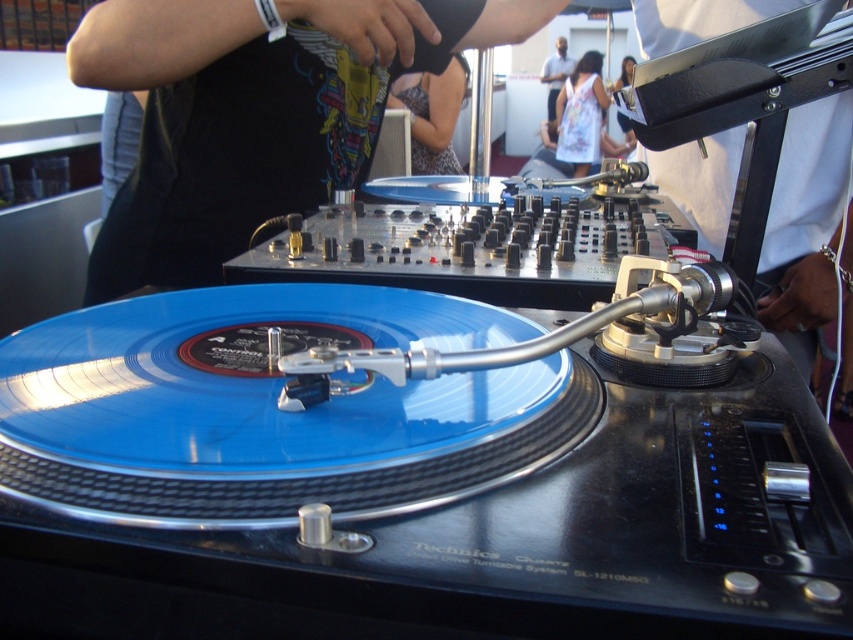
Is patterned fabric dress at center positioned behind dark blue shirt at upper center?

No, it is in front of dark blue shirt at upper center.

Who is higher up, patterned fabric dress at center or dark blue shirt at upper center?

dark blue shirt at upper center

Is point (421, 115) positioned in front of point (553, 72)?

Yes, point (421, 115) is in front of point (553, 72).

Where is `patterned fabric dress at center`? The width and height of the screenshot is (853, 640). patterned fabric dress at center is located at coordinates (433, 116).

Does black matte shirt at upper center have a greater height compared to dark blue shirt at upper center?

Yes.

Does point (165, 92) come behind point (563, 42)?

No, it is not.

At what (x,y) coordinates should I click in order to perform the action: click on black matte shirt at upper center. Please return your answer as a coordinate pair (x, y). This screenshot has width=853, height=640. Looking at the image, I should click on (254, 113).

Who is lower down, dark blue shirt at upper center or metallic silver microphone at upper center?

metallic silver microphone at upper center is below.

Is dark blue shirt at upper center to the right of metallic silver microphone at upper center from the viewer's perspective?

Incorrect, dark blue shirt at upper center is not on the right side of metallic silver microphone at upper center.

Between point (561, 45) and point (625, 129), which one is positioned in front?

Positioned in front is point (625, 129).

Locate an element on the screen. Image resolution: width=853 pixels, height=640 pixels. dark blue shirt at upper center is located at coordinates (555, 74).